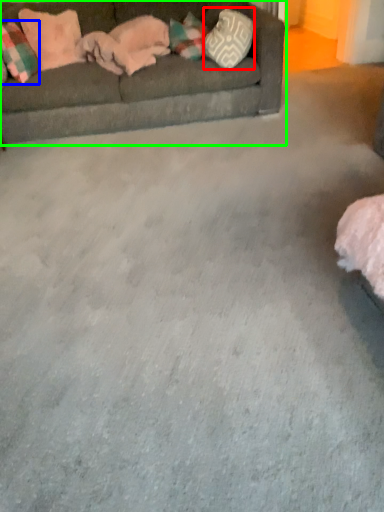
Question: Which is nearer to the pillow (highlighted by a red box)? pillow (highlighted by a blue box) or studio couch (highlighted by a green box).

Choices:
 (A) pillow
 (B) studio couch

Answer: (B)